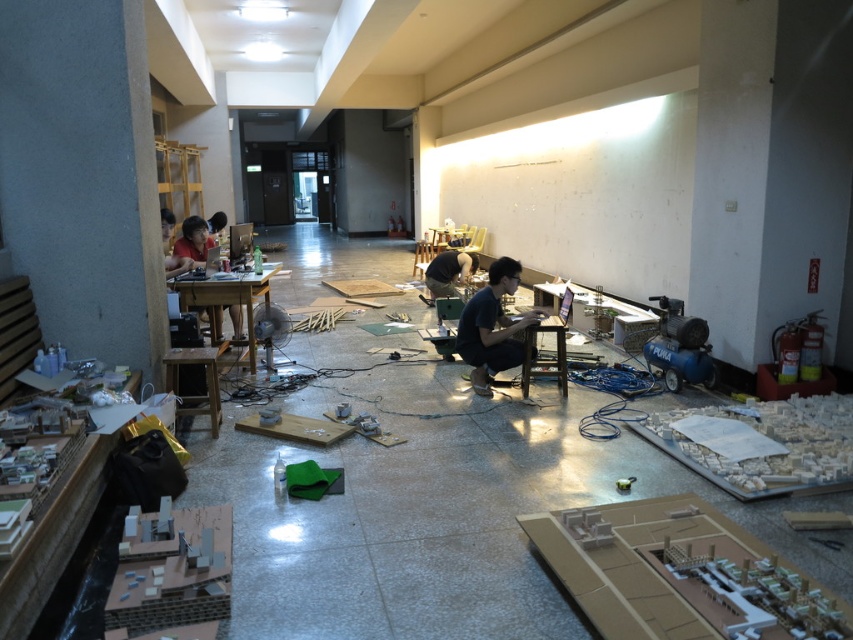
Question: Estimate the real-world distances between objects in this image. Which object is farther from the matte black shirt at upper left?

Choices:
 (A) matte black shirt at left
 (B) dark blue shirt at center

Answer: (B)

Question: Is matte black shirt at left smaller than matte black shirt at center?

Choices:
 (A) yes
 (B) no

Answer: (A)

Question: From the image, what is the correct spatial relationship of dark blue shirt at center in relation to matte black shirt at center?

Choices:
 (A) below
 (B) above

Answer: (A)

Question: Does dark blue shirt at center appear under matte black shirt at left?

Choices:
 (A) no
 (B) yes

Answer: (B)

Question: Which of the following is the farthest from the observer?

Choices:
 (A) (221, 216)
 (B) (178, 257)
 (C) (498, 266)

Answer: (A)

Question: Which point appears closest to the camera in this image?

Choices:
 (A) (196, 259)
 (B) (167, 240)

Answer: (A)